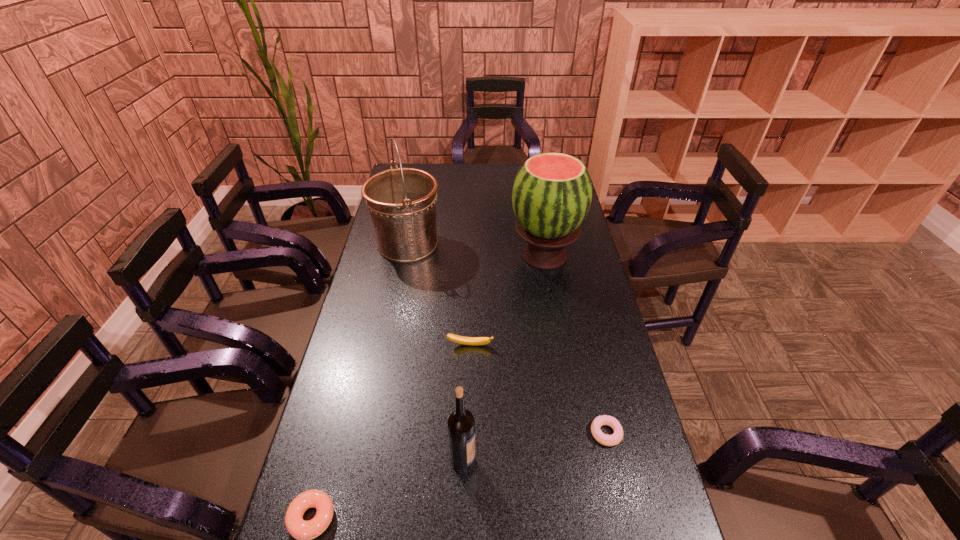
Locate an element on the screen. The width and height of the screenshot is (960, 540). blank area in the image that satisfies the following two spatial constraints: 1. at the stem of the fourth nearest object; 2. on the left side of the right doughnut is located at coordinates (468, 433).

Locate an element on the screen. The height and width of the screenshot is (540, 960). free point that satisfies the following two spatial constraints: 1. at the stem of the fourth tallest object; 2. on the label of the second nearest object is located at coordinates (468, 461).